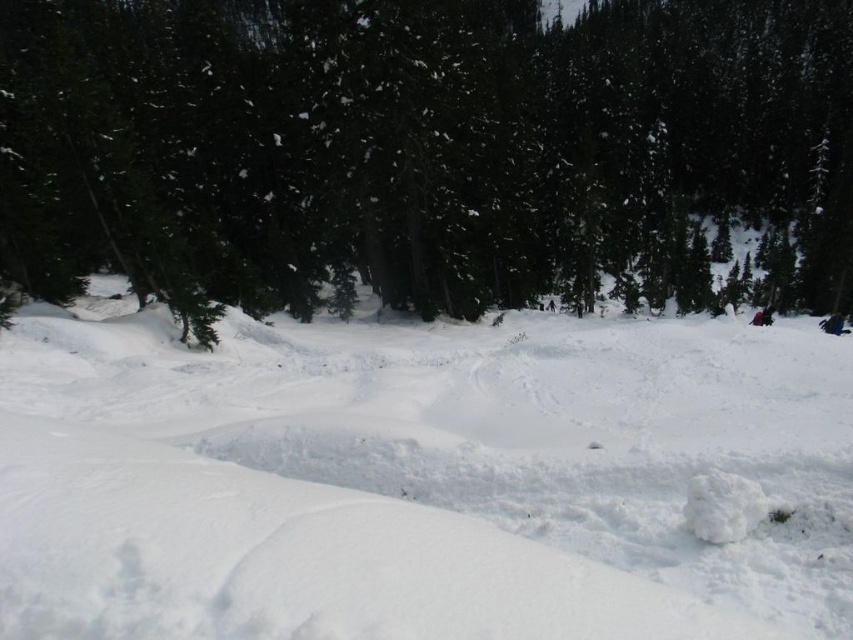
Who is taller, white fluffy snow at center or green matte tree at upper center?

With more height is green matte tree at upper center.

Between white fluffy snow at center and green matte tree at upper center, which one is positioned lower?

white fluffy snow at center is below.

Does point (173, 564) come in front of point (44, 83)?

Yes, point (173, 564) is closer to viewer.

Where is `white fluffy snow at center`? white fluffy snow at center is located at coordinates (418, 477).